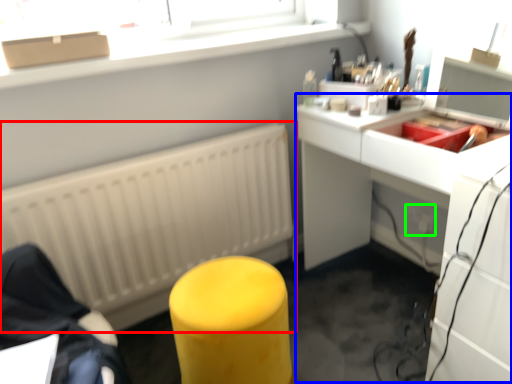
Question: Considering the real-world distances, which object is closest to radiator (highlighted by a red box)? computer desk (highlighted by a blue box) or electric outlet (highlighted by a green box).

Choices:
 (A) computer desk
 (B) electric outlet

Answer: (A)